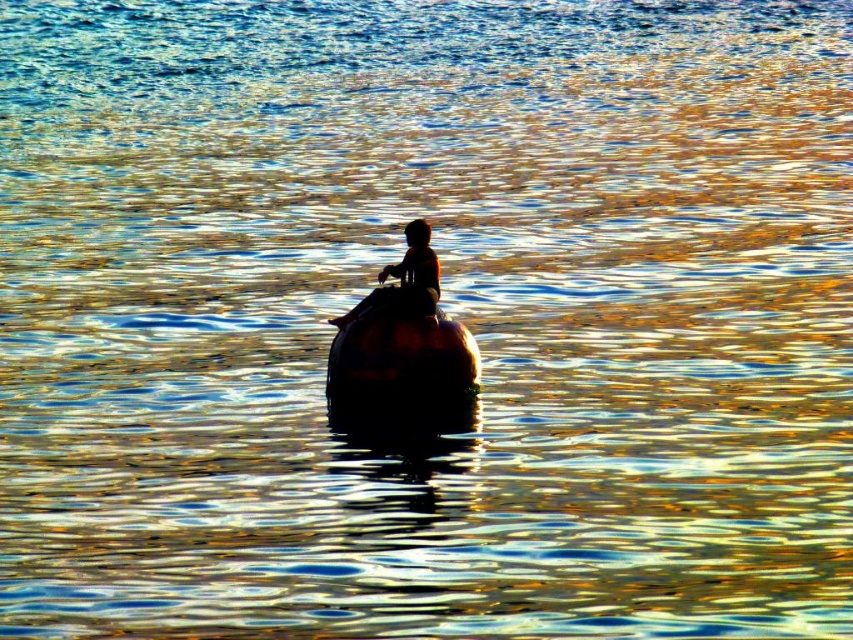
Describe the element at coordinates (399, 358) in the screenshot. This screenshot has height=640, width=853. I see `shiny brown boat at center` at that location.

How much distance is there between shiny brown boat at center and silhouette human at center?

19.47 inches

Between point (358, 396) and point (416, 252), which one is positioned behind?

The point (358, 396) is behind.

Image resolution: width=853 pixels, height=640 pixels. What are the coordinates of `shiny brown boat at center` in the screenshot? It's located at (399, 358).